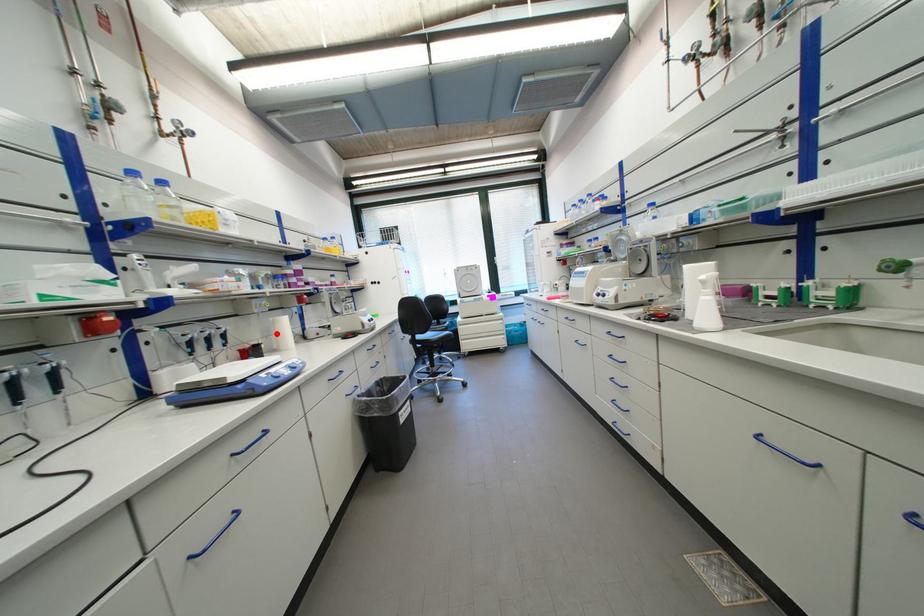
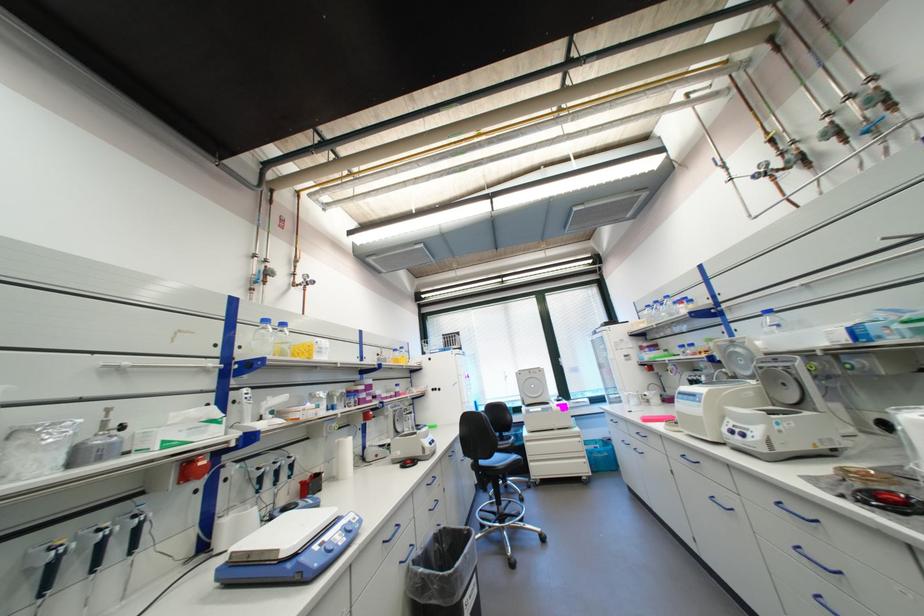
Find the pixel in the second image that matches the highlighted location in the first image.

(339, 458)